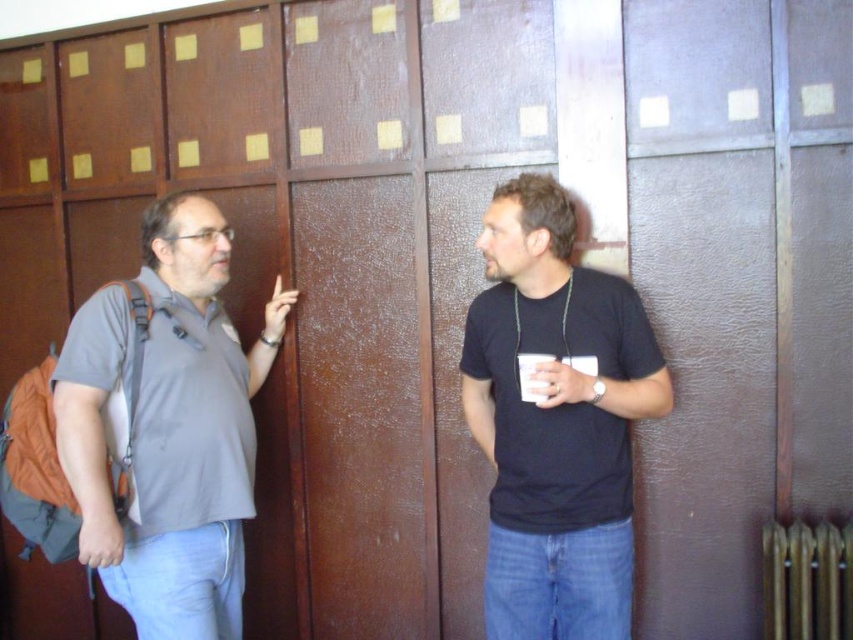
From the picture: Is black matte shirt at right smaller than metallic gold radiator at lower right?

No, black matte shirt at right is not smaller than metallic gold radiator at lower right.

Does black matte shirt at right come in front of metallic gold radiator at lower right?

Yes, black matte shirt at right is in front of metallic gold radiator at lower right.

Which is in front, point (544, 228) or point (764, 548)?

Point (544, 228) is in front.

At what (x,y) coordinates should I click in order to perform the action: click on black matte shirt at right. Please return your answer as a coordinate pair (x, y). Looking at the image, I should click on (555, 420).

Can you confirm if black matte shirt at right is bigger than gray cotton shirt at left?

No.

Does black matte shirt at right appear under gray cotton shirt at left?

Incorrect, black matte shirt at right is not positioned below gray cotton shirt at left.

The height and width of the screenshot is (640, 853). Describe the element at coordinates (555, 420) in the screenshot. I see `black matte shirt at right` at that location.

The image size is (853, 640). I want to click on black matte shirt at right, so click(x=555, y=420).

Which is in front, point (181, 566) or point (798, 630)?

Point (181, 566)

Between point (173, 552) and point (813, 576), which one is positioned behind?

The point (813, 576) is behind.

Where is `gray cotton shirt at left`? This screenshot has height=640, width=853. gray cotton shirt at left is located at coordinates (170, 428).